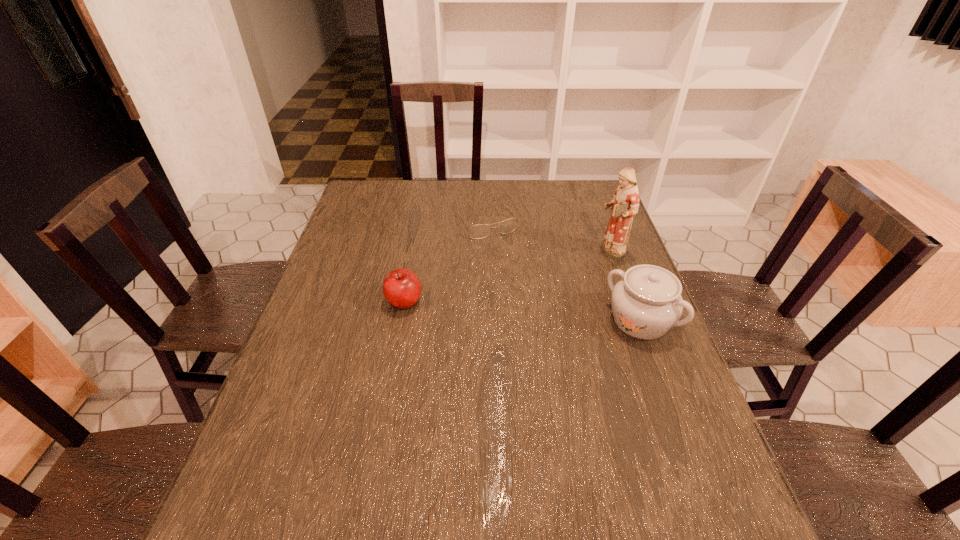
At what (x,y) coordinates should I click in order to perform the action: click on the second shortest object. Please return your answer as a coordinate pair (x, y). This screenshot has width=960, height=540. Looking at the image, I should click on (402, 288).

Where is `the leftmost object`? The image size is (960, 540). the leftmost object is located at coordinates (402, 288).

Find the location of a particular element. This screenshot has width=960, height=540. chinaware is located at coordinates (646, 303).

Where is `the third nearest object`? This screenshot has height=540, width=960. the third nearest object is located at coordinates [x=625, y=203].

Find the location of a particular element. This screenshot has width=960, height=540. figurine is located at coordinates (625, 203).

Where is `the shortest object`? the shortest object is located at coordinates (480, 231).

Locate an element on the screen. The image size is (960, 540). the third object from right to left is located at coordinates (480, 231).

At what (x,y) coordinates should I click in order to perform the action: click on free space located on the front of the second shortest object. Please return your answer as a coordinate pair (x, y). The image size is (960, 540). Looking at the image, I should click on (395, 351).

The width and height of the screenshot is (960, 540). In order to click on free space located on the back of the chinaware in this screenshot , I will do `click(614, 251)`.

Where is `vacant space situated 0.090m on the front-facing side of the tallest object`? The width and height of the screenshot is (960, 540). vacant space situated 0.090m on the front-facing side of the tallest object is located at coordinates coord(578,268).